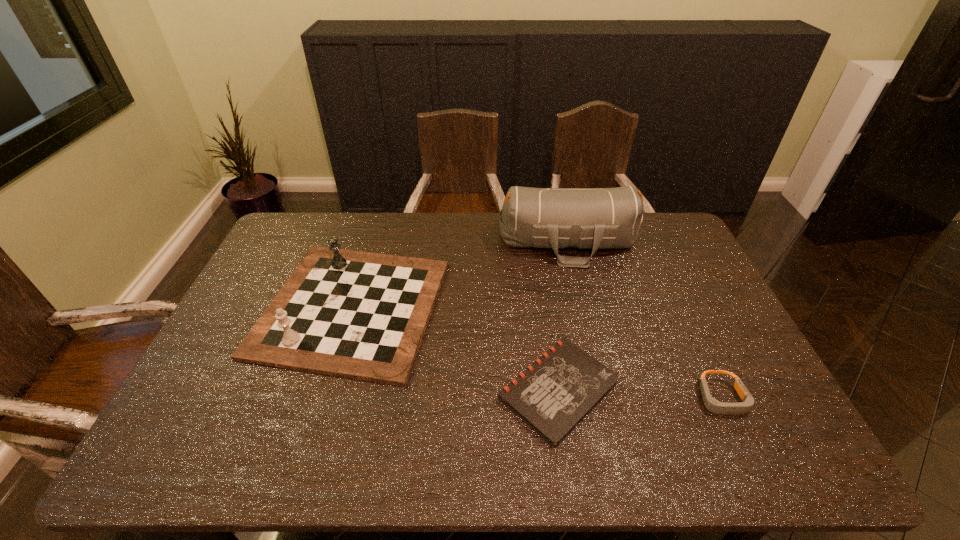
The height and width of the screenshot is (540, 960). What are the coordinates of `the tallest object` in the screenshot? It's located at (587, 218).

This screenshot has height=540, width=960. What are the coordinates of `the leftmost object` in the screenshot? It's located at (360, 315).

Identify the location of gameboard. The image size is (960, 540). (360, 315).

I want to click on the third tallest object, so click(x=711, y=404).

The height and width of the screenshot is (540, 960). I want to click on notebook, so click(553, 395).

What are the coordinates of `vacant area located 0.130m on the front of the duffel bag` in the screenshot? It's located at (582, 296).

Find the location of a particular element. blank space located on the back of the second tallest object is located at coordinates (378, 222).

You are a GUI agent. You are given a task and a screenshot of the screen. Output one action in this format:
    pyautogui.click(x=<x>, y=<y>)
    Task: Click on the vacant area situated 0.110m on the front and back of the third tallest object
    The image size is (960, 540).
    Given the screenshot: What is the action you would take?
    pyautogui.click(x=754, y=467)

Find the location of a particular element. The width and height of the screenshot is (960, 540). vacant space located on the right of the notebook is located at coordinates pos(758,389).

Locate an element on the screen. Image resolution: width=960 pixels, height=540 pixels. duffel bag present at the far edge is located at coordinates point(587,218).